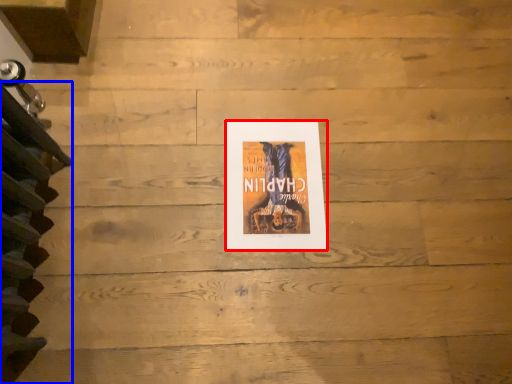
Question: Which object appears farthest to the camera in this image, poster (highlighted by a red box) or stairwell (highlighted by a blue box)?

Choices:
 (A) poster
 (B) stairwell

Answer: (A)